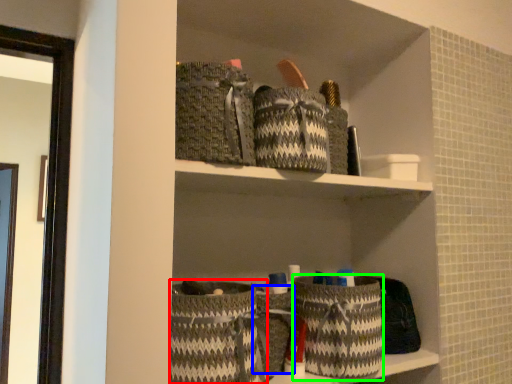
Question: Based on their relative distances, which object is farther from basket (highlighted by a red box)? Choose from basket (highlighted by a blue box) and basket (highlighted by a green box).

Choices:
 (A) basket
 (B) basket

Answer: (B)